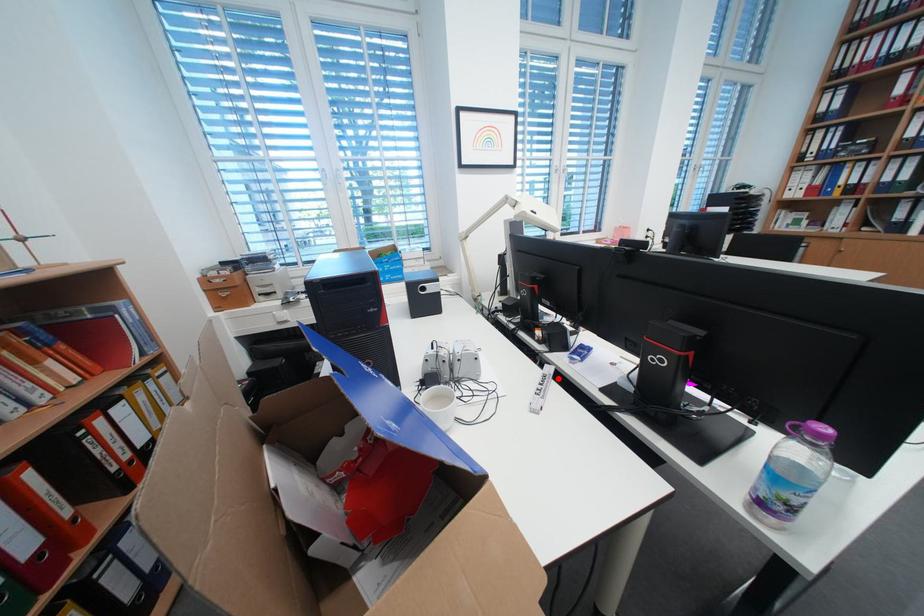
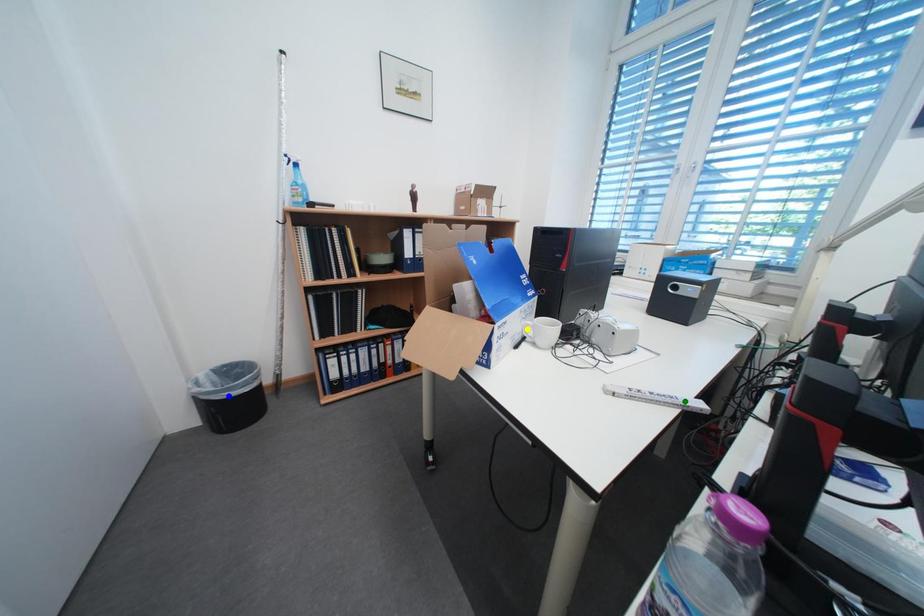
Question: I am providing you with two images of the same scene from different viewpoints. A red point is marked on the first image. You are given multiple points on the second image. Which point in image 2 is actually the same real-world point as the red point in image 1?

Choices:
 (A) yellow point
 (B) blue point
 (C) green point

Answer: (C)